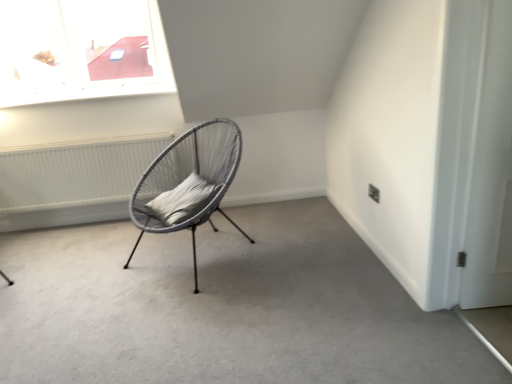
Locate an element on the screen. free region under matte grey wicker chair at center (from a real-world perspective) is located at coordinates (201, 250).